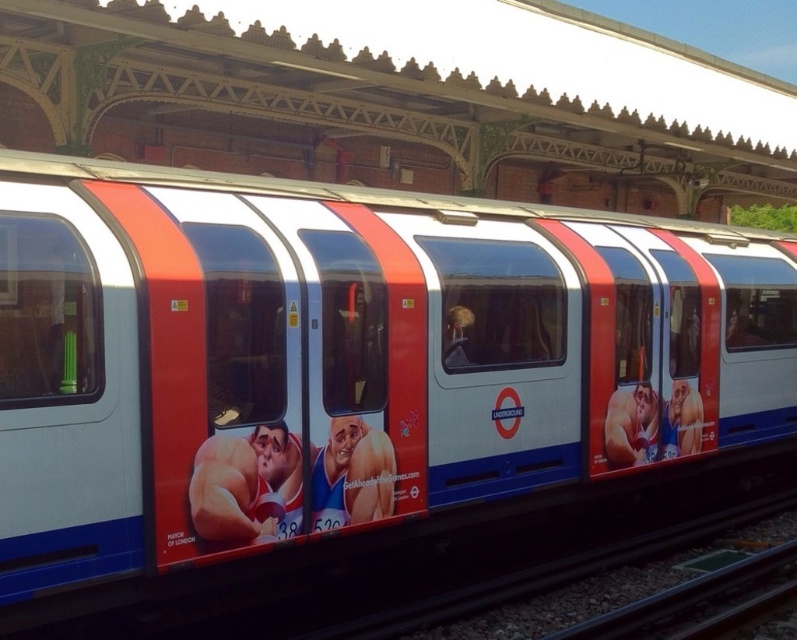
Question: Is metallic silver train at center in front of metal/smooth train track at bottom?

Choices:
 (A) yes
 (B) no

Answer: (A)

Question: Which of the following is the closest to the observer?

Choices:
 (A) (607, 628)
 (B) (658, 266)

Answer: (A)

Question: Does metallic silver train at center have a lesser width compared to metal/smooth train track at bottom?

Choices:
 (A) no
 (B) yes

Answer: (A)

Question: Does metallic silver train at center appear under metal/smooth train track at bottom?

Choices:
 (A) yes
 (B) no

Answer: (B)